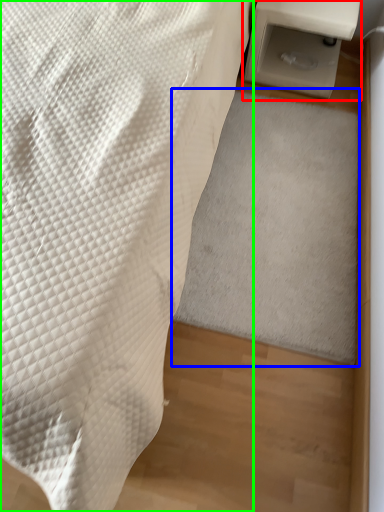
Question: Estimate the real-world distances between objects in this image. Which object is farther from table (highlighted by a red box), mat (highlighted by a blue box) or furniture (highlighted by a green box)?

Choices:
 (A) mat
 (B) furniture

Answer: (B)